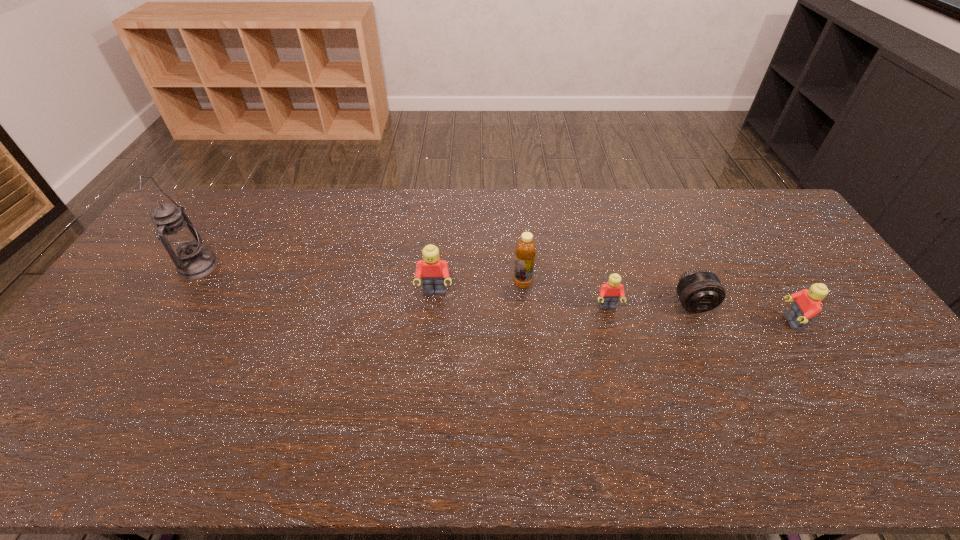
This screenshot has width=960, height=540. I want to click on vacant position located 0.080m on the face of the farthest Lego, so (x=432, y=322).

Where is `free location located on the face of the second Lego from right to left`? The width and height of the screenshot is (960, 540). free location located on the face of the second Lego from right to left is located at coordinates (633, 402).

Image resolution: width=960 pixels, height=540 pixels. I want to click on vacant space located on the face of the fourth tallest object, so click(710, 322).

Identify the location of free space located 0.150m on the face of the fourth tallest object. The image size is (960, 540). (729, 322).

Where is `vacant area situated 0.160m on the face of the fourth tallest object`? vacant area situated 0.160m on the face of the fourth tallest object is located at coordinates (725, 322).

Where is `free space located 0.300m on the front-facing side of the second object from right to left`? The height and width of the screenshot is (540, 960). free space located 0.300m on the front-facing side of the second object from right to left is located at coordinates (741, 415).

At what (x,y) coordinates should I click in order to perform the action: click on free spot located on the right of the oil lamp. Please return your answer as a coordinate pair (x, y). Image resolution: width=960 pixels, height=540 pixels. Looking at the image, I should click on (306, 267).

Identify the location of vacant area situated on the front of the bottle. (530, 365).

I want to click on object located at the left edge, so click(x=181, y=240).

Find the location of a particular element. The image size is (960, 540). free space at the far edge is located at coordinates (342, 193).